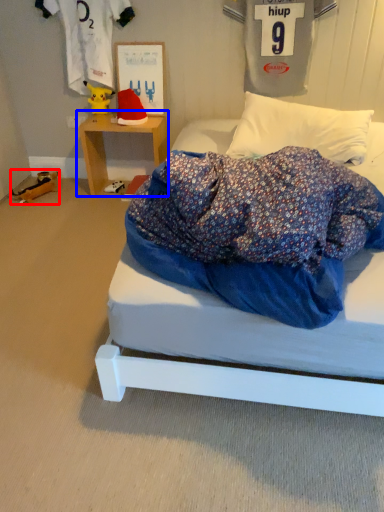
Question: Which of the following is the closest to the observer, toy (highlighted by a red box) or table (highlighted by a blue box)?

Choices:
 (A) toy
 (B) table

Answer: (B)